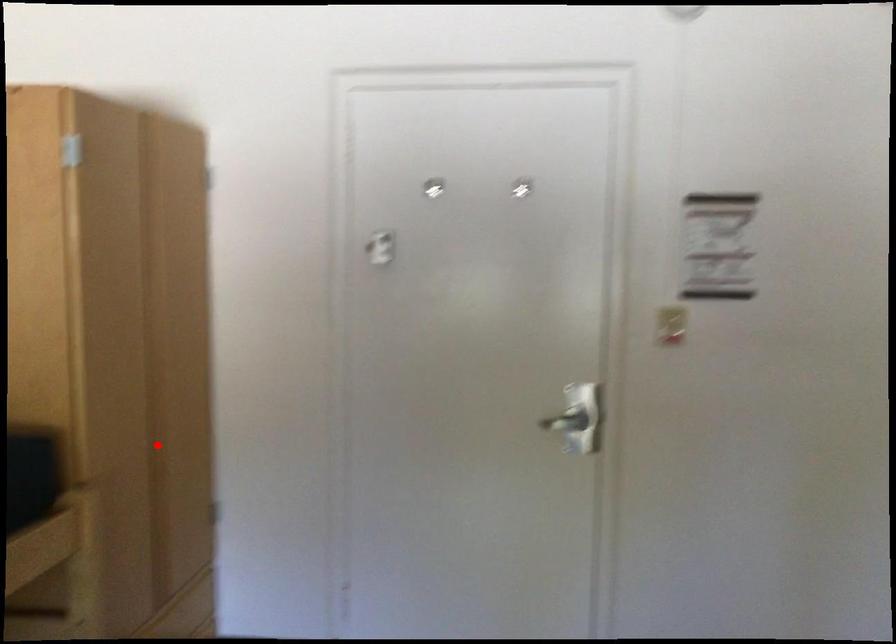
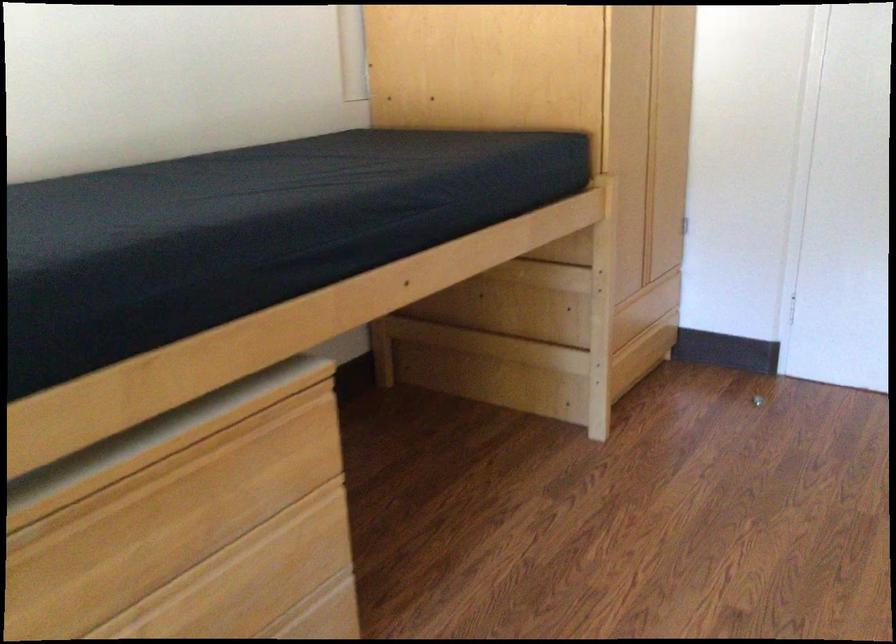
Question: A red point is marked in image1. In image2, is the corresponding 3D point closer to the camera or farther? Reply with the corresponding letter.

Choices:
 (A) The corresponding 3D point is closer.
 (B) The corresponding 3D point is farther.

Answer: (B)